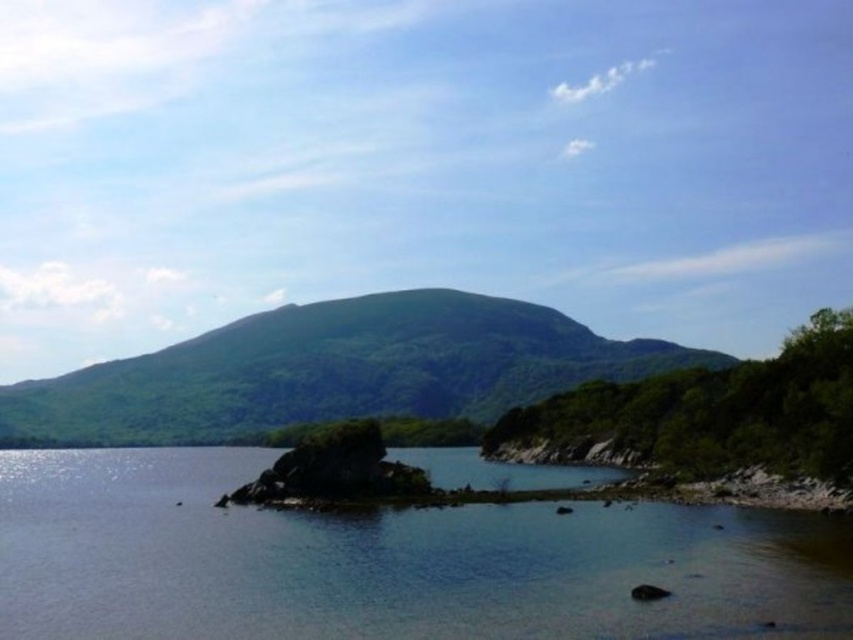
Question: Is clear water at center thinner than green leafy mountain at center?

Choices:
 (A) yes
 (B) no

Answer: (A)

Question: Is clear water at center smaller than green leafy mountain at center?

Choices:
 (A) yes
 (B) no

Answer: (A)

Question: Can you confirm if clear water at center is positioned to the right of green leafy mountain at center?

Choices:
 (A) yes
 (B) no

Answer: (A)

Question: Which object appears farthest from the camera in this image?

Choices:
 (A) green leafy mountain at center
 (B) clear water at center

Answer: (A)

Question: Which point is farther to the camera?

Choices:
 (A) clear water at center
 (B) green leafy mountain at center

Answer: (B)